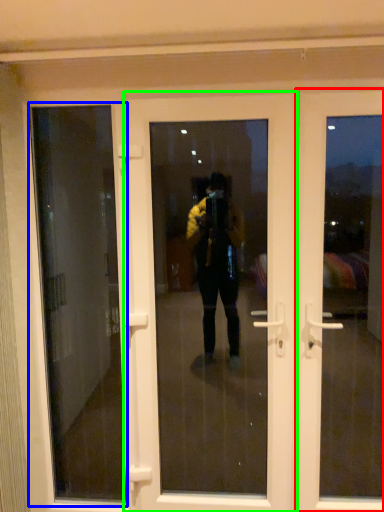
Question: Considering the real-world distances, which object is closest to door (highlighted by a red box)? window screen (highlighted by a blue box) or door (highlighted by a green box).

Choices:
 (A) window screen
 (B) door

Answer: (B)